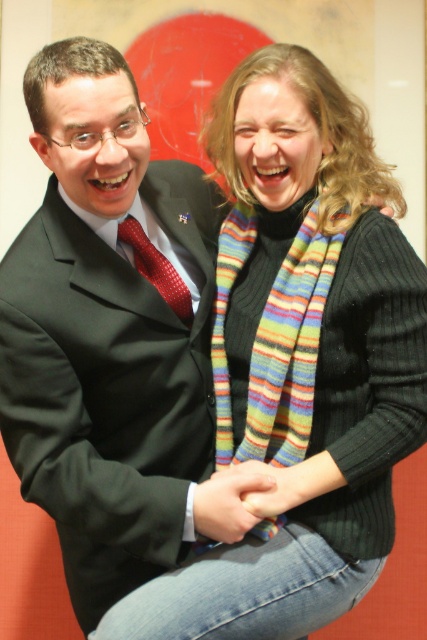
You are a photographer standing 1.5 meters away from the multicolored knitted scarf at center. Can you reach it without moving your feet?

The multicolored knitted scarf at center is 1.12 meters from viewer, so yes, you can reach it without moving your feet since it is closer than your 1.5 meters distance.

You are a photographer standing at point (315, 321). You need to take a photo of both the man on the left and the woman on the right. Can you fit both of them in the frame without moving your position? Explain your reasoning.

The man on the left and the woman on the right are 1.13 meters apart. Since you are positioned at point (315, 321), which is likely between them, you can adjust your camera angle or zoom to include both subjects in the frame without moving your position.

You are a photographer trying to capture a closeup of both the multicolored knitted scarf at center and the red silk tie at center. Since you can only focus on one object at a time, which one should you choose to ensure the other remains in the background without being too blurry?

The multicolored knitted scarf at center is larger than the red silk tie at center, so focusing on the scarf would keep the tie in the background with less blur since it is smaller and farther from the camera.